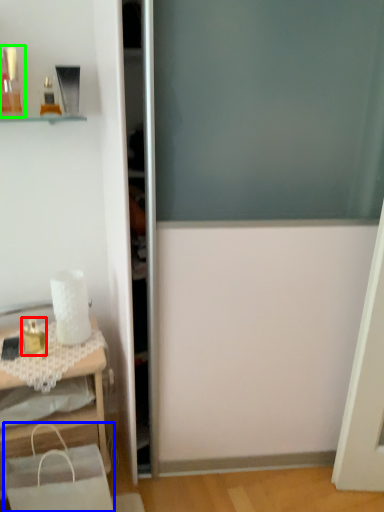
Question: Which is farther away from toiletry (highlighted by a red box)? shopping bag (highlighted by a blue box) or toiletry (highlighted by a green box)?

Choices:
 (A) shopping bag
 (B) toiletry

Answer: (B)